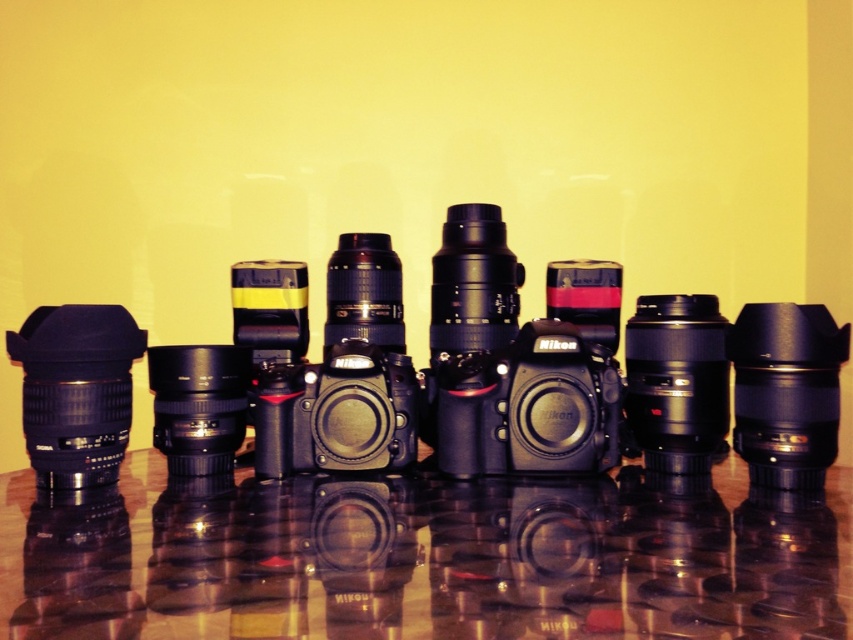
You are a photographer setting up a display for a photography exhibition. You have a matte black camera at center and a matte black lens at left. The display table is 1 meter wide. Can you place both items on the table without them touching each other?

The matte black camera at center is 30.55 centimeters away from the matte black lens at left. Since the table is 1 meter wide, which is 100 centimeters, there is enough space to place both items without them touching. You can position them with at least 30.55 centimeters between them.

You are a photographer setting up a display for a photography exhibition. You have a matte black camera at center and a glossy reflective table at center. Based on their positions, which object is more to the right?

The matte black camera at center is more to the right than the glossy reflective table at center.